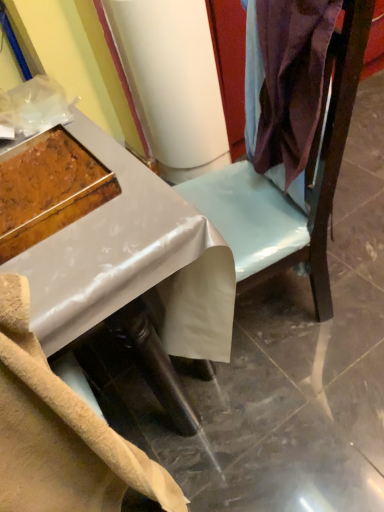
Where is `vacant space underneath satin purple fabric at upper right (from a real-world perspective)`? vacant space underneath satin purple fabric at upper right (from a real-world perspective) is located at coordinates (304, 298).